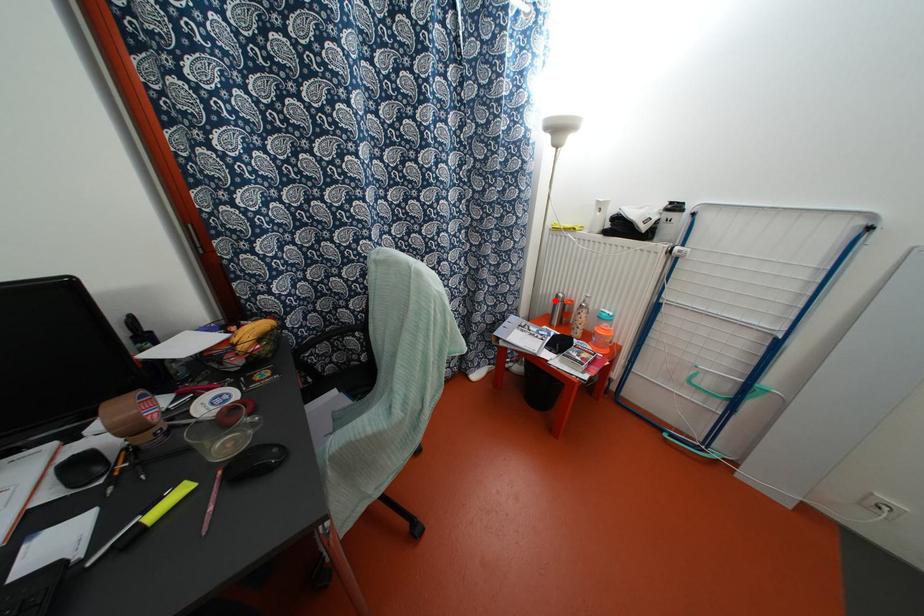
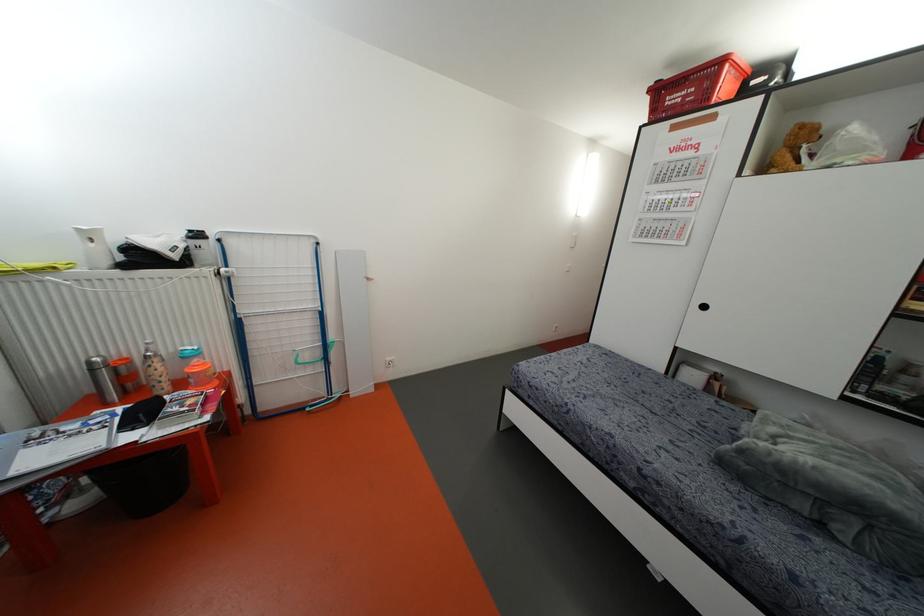
Question: I am providing you with two images of the same scene from different viewpoints. Image1 has a red point marked. In image2, the corresponding 3D location appears at what relative position? Reply with the corresponding letter.

Choices:
 (A) Closer
 (B) Farther

Answer: (B)